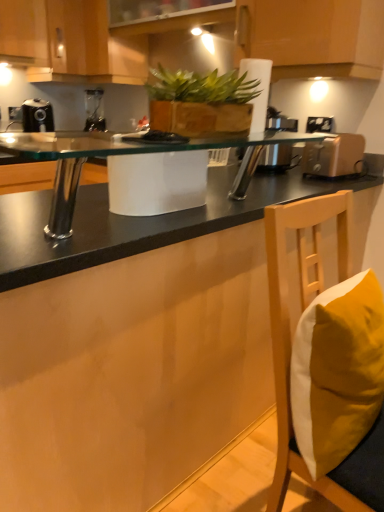
Question: From the image's perspective, is matte wood cabinet at upper left, the 1th cabinetry from the left, located above black plastic coffee machine at left?

Choices:
 (A) yes
 (B) no

Answer: (A)

Question: Would you say matte wood cabinet at upper left, the 1th cabinetry from the left, is outside black plastic coffee machine at left?

Choices:
 (A) no
 (B) yes

Answer: (B)

Question: Is matte wood cabinet at upper left, the 1th cabinetry from the left, aimed at black plastic coffee machine at left?

Choices:
 (A) yes
 (B) no

Answer: (B)

Question: Is matte wood cabinet at upper left, the 3th cabinetry when ordered from right to left, shorter than black plastic coffee machine at left?

Choices:
 (A) yes
 (B) no

Answer: (B)

Question: Is there a large distance between matte wood cabinet at upper left, the 3th cabinetry when ordered from right to left, and black plastic coffee machine at left?

Choices:
 (A) no
 (B) yes

Answer: (A)

Question: Based on their sizes in the image, would you say white plastic electric outlet at upper right is bigger or smaller than green leafy plant at center?

Choices:
 (A) small
 (B) big

Answer: (A)

Question: Would you say white plastic electric outlet at upper right is to the left or to the right of green leafy plant at center in the picture?

Choices:
 (A) right
 (B) left

Answer: (A)

Question: From a real-world perspective, relative to green leafy plant at center, is white plastic electric outlet at upper right vertically above or below?

Choices:
 (A) below
 (B) above

Answer: (A)

Question: Considering the positions of white plastic electric outlet at upper right and green leafy plant at center in the image, is white plastic electric outlet at upper right taller or shorter than green leafy plant at center?

Choices:
 (A) short
 (B) tall

Answer: (A)

Question: Is metallic silver toaster at right wider or thinner than velvet yellow pillow at lower right?

Choices:
 (A) wide
 (B) thin

Answer: (A)

Question: Is metallic silver toaster at right to the left or to the right of velvet yellow pillow at lower right in the image?

Choices:
 (A) left
 (B) right

Answer: (B)

Question: From the image's perspective, is metallic silver toaster at right located above or below velvet yellow pillow at lower right?

Choices:
 (A) below
 (B) above

Answer: (B)

Question: Is metallic silver toaster at right inside or outside of velvet yellow pillow at lower right?

Choices:
 (A) inside
 (B) outside

Answer: (B)

Question: From a real-world perspective, is black plastic coffee machine at left physically located above or below matte wood cabinet at upper left, the 3th cabinetry when ordered from right to left?

Choices:
 (A) below
 (B) above

Answer: (A)

Question: Relative to matte wood cabinet at upper left, the 1th cabinetry from the left, is black plastic coffee machine at left in front or behind?

Choices:
 (A) front
 (B) behind

Answer: (B)